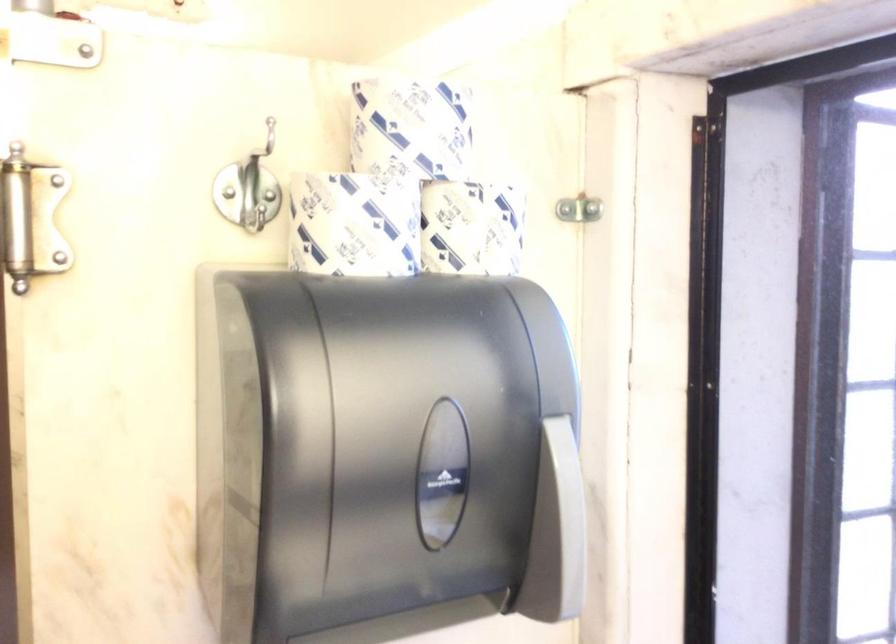
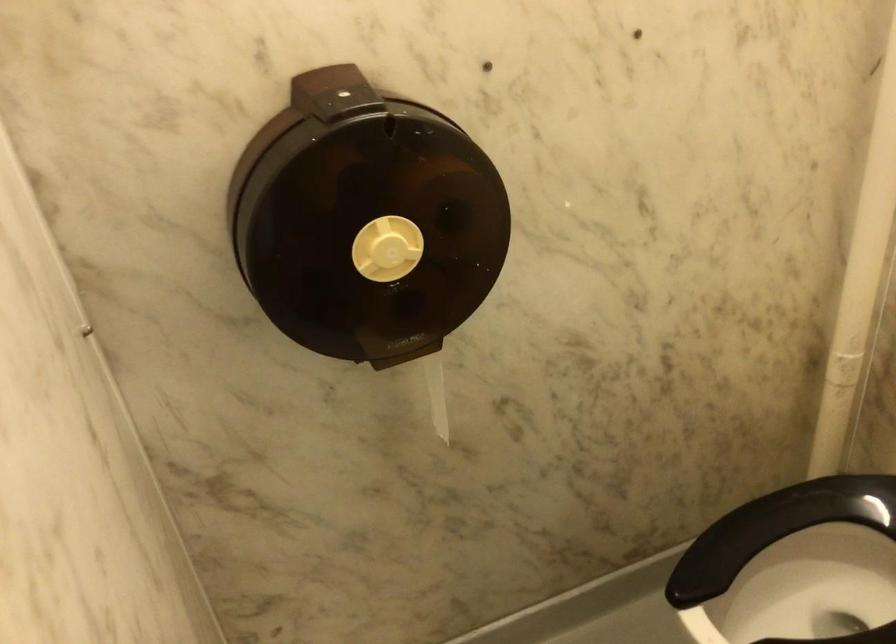
Question: How did the camera likely rotate?

Choices:
 (A) Left
 (B) Right
 (C) Up
 (D) Down

Answer: (D)